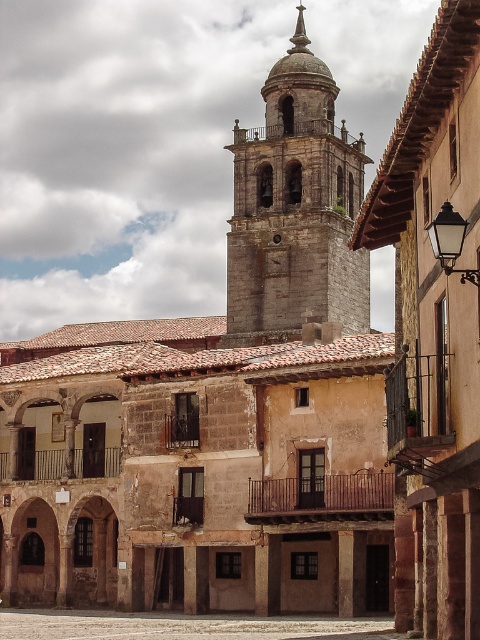
Question: Does gray stone bell tower at upper center have a larger size compared to smooth stone courtyard at center?

Choices:
 (A) yes
 (B) no

Answer: (A)

Question: Which point is closer to the camera?

Choices:
 (A) (286, 627)
 (B) (333, 100)

Answer: (A)

Question: Does gray stone bell tower at upper center appear on the right side of smooth stone courtyard at center?

Choices:
 (A) yes
 (B) no

Answer: (A)

Question: Which of the following is the farthest from the observer?

Choices:
 (A) (46, 616)
 (B) (283, 60)

Answer: (B)

Question: Is gray stone bell tower at upper center to the right of smooth stone courtyard at center from the viewer's perspective?

Choices:
 (A) no
 (B) yes

Answer: (B)